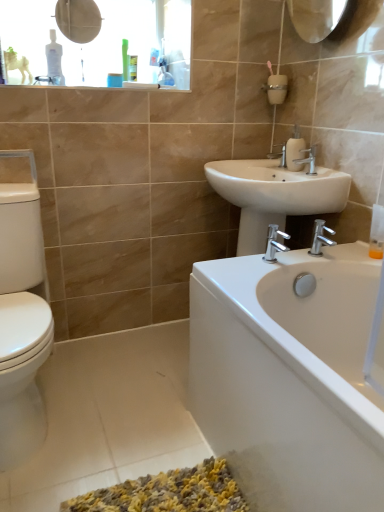
Question: Is the position of translucent plastic soap dispenser at right less distant than that of white glossy bathtub at lower right?

Choices:
 (A) no
 (B) yes

Answer: (A)

Question: Is the position of translucent plastic soap dispenser at right more distant than that of white glossy bathtub at lower right?

Choices:
 (A) no
 (B) yes

Answer: (B)

Question: Is translucent plastic soap dispenser at right directly adjacent to white glossy bathtub at lower right?

Choices:
 (A) yes
 (B) no

Answer: (B)

Question: Is translucent plastic soap dispenser at right smaller than white glossy bathtub at lower right?

Choices:
 (A) yes
 (B) no

Answer: (A)

Question: From a real-world perspective, is translucent plastic soap dispenser at right located higher than white glossy bathtub at lower right?

Choices:
 (A) no
 (B) yes

Answer: (B)

Question: In terms of width, does white glossy soap dispenser at upper right look wider or thinner when compared to white ceramic sink at center?

Choices:
 (A) wide
 (B) thin

Answer: (B)

Question: Is white glossy soap dispenser at upper right bigger or smaller than white ceramic sink at center?

Choices:
 (A) small
 (B) big

Answer: (A)

Question: From a real-world perspective, relative to white ceramic sink at center, is white glossy soap dispenser at upper right vertically above or below?

Choices:
 (A) below
 (B) above

Answer: (B)

Question: Considering the positions of point (292, 168) and point (329, 190), is point (292, 168) closer or farther from the camera than point (329, 190)?

Choices:
 (A) closer
 (B) farther

Answer: (B)

Question: In the image, is silver metallic faucet at upper center, which is the 1th tap in top-to-bottom order, positioned in front of or behind translucent plastic soap dispenser at right?

Choices:
 (A) behind
 (B) front

Answer: (A)

Question: Looking at their shapes, would you say silver metallic faucet at upper center, the 1th tap from the back, is wider or thinner than translucent plastic soap dispenser at right?

Choices:
 (A) wide
 (B) thin

Answer: (A)

Question: Is silver metallic faucet at upper center, which is the 1th tap in top-to-bottom order, situated inside translucent plastic soap dispenser at right or outside?

Choices:
 (A) inside
 (B) outside

Answer: (B)

Question: Considering the positions of silver metallic faucet at upper center, which is the 1th tap in top-to-bottom order, and translucent plastic soap dispenser at right in the image, is silver metallic faucet at upper center, which is the 1th tap in top-to-bottom order, bigger or smaller than translucent plastic soap dispenser at right?

Choices:
 (A) small
 (B) big

Answer: (A)

Question: Is matte plastic medicine cabinet at upper left inside the boundaries of white ceramic sink at center, or outside?

Choices:
 (A) outside
 (B) inside

Answer: (A)

Question: In terms of size, does matte plastic medicine cabinet at upper left appear bigger or smaller than white ceramic sink at center?

Choices:
 (A) small
 (B) big

Answer: (A)